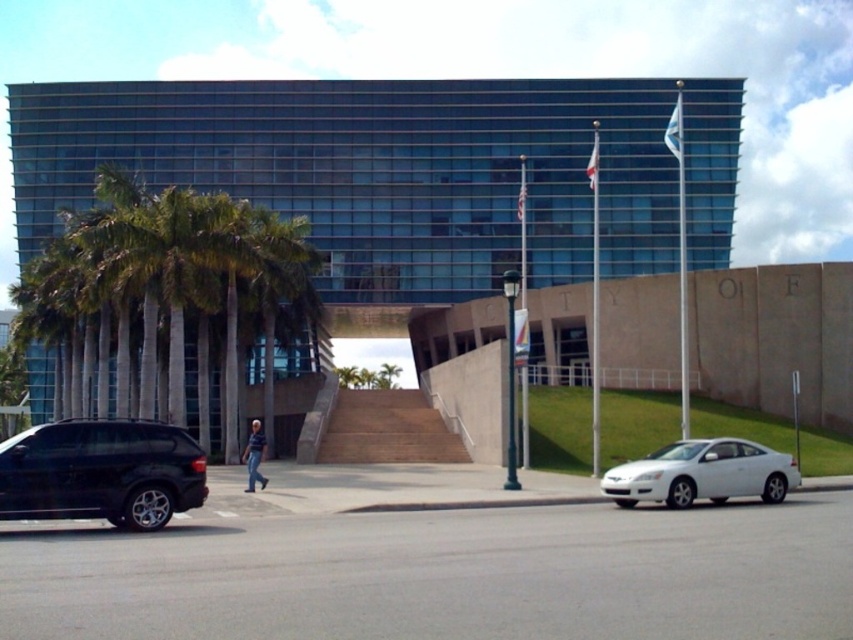
Is point (15, 502) farther from viewer compared to point (668, 483)?

No, (15, 502) is in front of (668, 483).

Which of these two, shiny black suv at lower left or white glossy car at lower right, stands taller?

white glossy car at lower right is taller.

This screenshot has width=853, height=640. Find the location of `shiny black suv at lower left`. shiny black suv at lower left is located at coordinates coord(102,472).